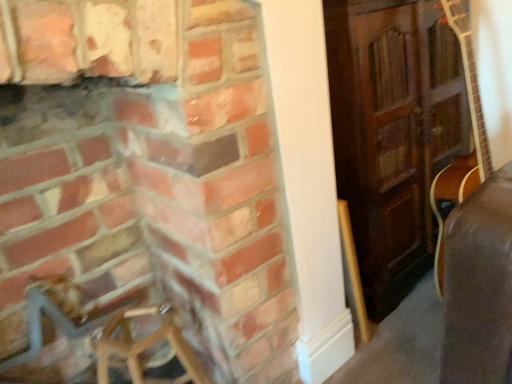
What do you see at coordinates (59, 339) in the screenshot? I see `wooden armchair at lower left` at bounding box center [59, 339].

Measure the distance between point (133, 299) and camera.

They are 1.19 meters apart.

Image resolution: width=512 pixels, height=384 pixels. Identify the location of wooden armchair at lower left. (59, 339).

Image resolution: width=512 pixels, height=384 pixels. Describe the element at coordinates (141, 182) in the screenshot. I see `brick fireplace at left` at that location.

Locate an element on the screen. The height and width of the screenshot is (384, 512). brick fireplace at left is located at coordinates (141, 182).

The height and width of the screenshot is (384, 512). In order to click on wooden armchair at lower left in this screenshot , I will do (59, 339).

Considering the relative positions of wooden armchair at lower left and brick fireplace at left in the image provided, is wooden armchair at lower left to the right of brick fireplace at left from the viewer's perspective?

Incorrect, wooden armchair at lower left is not on the right side of brick fireplace at left.

Does wooden armchair at lower left lie behind brick fireplace at left?

Yes, it is behind brick fireplace at left.

Is point (27, 362) closer or farther from the camera than point (228, 2)?

Point (27, 362).

From the image's perspective, who appears lower, wooden armchair at lower left or brick fireplace at left?

wooden armchair at lower left, from the image's perspective.

From a real-world perspective, relative to brick fireplace at left, is wooden armchair at lower left vertically above or below?

From a real-world perspective, wooden armchair at lower left is physically below brick fireplace at left.

Based on the photo, considering the relative sizes of wooden armchair at lower left and brick fireplace at left in the image provided, is wooden armchair at lower left wider than brick fireplace at left?

In fact, wooden armchair at lower left might be narrower than brick fireplace at left.

Between wooden armchair at lower left and brick fireplace at left, which one has more height?

With more height is brick fireplace at left.

Does wooden armchair at lower left have a larger size compared to brick fireplace at left?

No.

Could brick fireplace at left be considered to be inside wooden armchair at lower left?

No.

Is wooden armchair at lower left next to brick fireplace at left?

wooden armchair at lower left and brick fireplace at left are not in contact.

Is wooden armchair at lower left facing towards brick fireplace at left?

Yes, wooden armchair at lower left faces towards brick fireplace at left.

What's the angular difference between wooden armchair at lower left and brick fireplace at left's facing directions?

0.995 degrees.

Measure the distance between wooden armchair at lower left and brick fireplace at left.

They are 10.11 inches apart.

Identify the location of armchair located behind the brick fireplace at left. Image resolution: width=512 pixels, height=384 pixels. (59, 339).

Considering the positions of objects brick fireplace at left and wooden armchair at lower left in the image provided, who is more to the right, brick fireplace at left or wooden armchair at lower left?

From the viewer's perspective, brick fireplace at left appears more on the right side.

Is brick fireplace at left in front of or behind wooden armchair at lower left in the image?

In the image, brick fireplace at left appears in front of wooden armchair at lower left.

From the picture: Which is nearer, (184, 243) or (24, 351)?

Clearly, point (184, 243) is closer to the camera than point (24, 351).

From the image's perspective, is brick fireplace at left under wooden armchair at lower left?

No.

From a real-world perspective, who is located lower, brick fireplace at left or wooden armchair at lower left?

wooden armchair at lower left is physically lower.

Is brick fireplace at left wider than wooden armchair at lower left?

Correct, the width of brick fireplace at left exceeds that of wooden armchair at lower left.

Based on the photo, is brick fireplace at left taller or shorter than wooden armchair at lower left?

Clearly, brick fireplace at left is taller compared to wooden armchair at lower left.

Does brick fireplace at left have a larger size compared to wooden armchair at lower left?

Indeed, brick fireplace at left has a larger size compared to wooden armchair at lower left.

Is brick fireplace at left positioned beyond the bounds of wooden armchair at lower left?

Indeed, brick fireplace at left is completely outside wooden armchair at lower left.

From the picture: Is brick fireplace at left in contact with wooden armchair at lower left?

brick fireplace at left and wooden armchair at lower left are clearly separated.

Is brick fireplace at left turned away from wooden armchair at lower left?

That's right, brick fireplace at left is facing away from wooden armchair at lower left.

You are a GUI agent. You are given a task and a screenshot of the screen. Output one action in this format:
    pyautogui.click(x=<x>, y=<y>)
    Task: Click on the armchair to the left of brick fireplace at left
    This screenshot has width=512, height=384.
    Given the screenshot: What is the action you would take?
    pyautogui.click(x=59, y=339)

The width and height of the screenshot is (512, 384). In the image, there is a brick fireplace at left. Find the location of `armchair below it (from the image's perspective)`. armchair below it (from the image's perspective) is located at coordinates (59, 339).

This screenshot has height=384, width=512. What are the coordinates of `fireplace located above the wooden armchair at lower left (from the image's perspective)` in the screenshot? It's located at (141, 182).